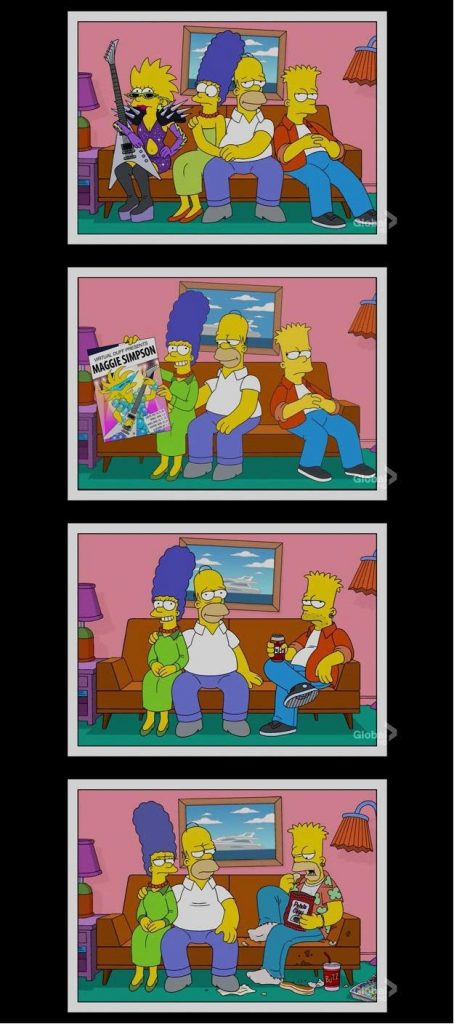
Locate an element on the screen. The image size is (454, 1024). end table is located at coordinates (87, 927), (81, 667), (81, 414), (82, 159).